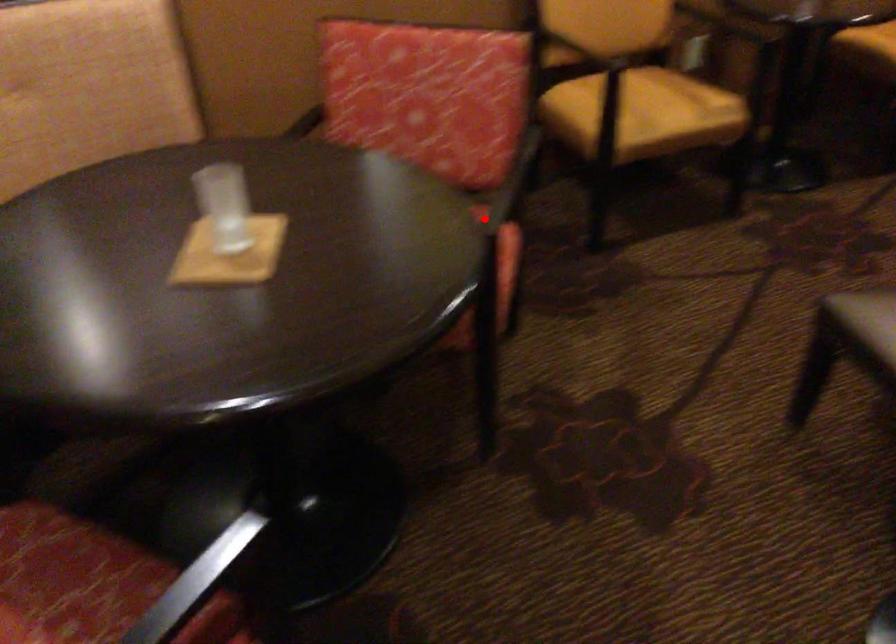
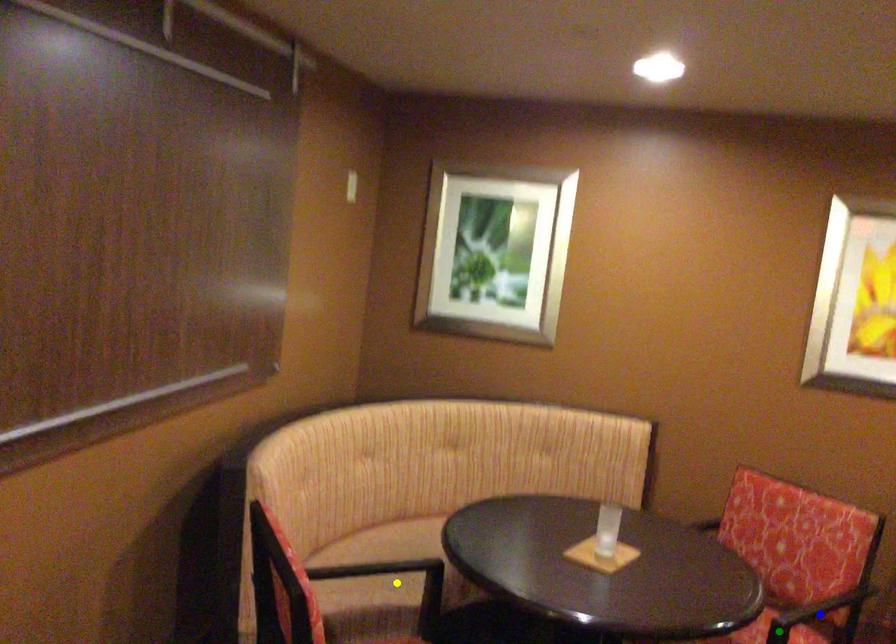
Question: I am providing you with two images of the same scene from different viewpoints. A red point is marked on the first image. You are given multiple points on the second image. Which mark in image 2 goes with the point in image 1?

Choices:
 (A) blue point
 (B) green point
 (C) yellow point

Answer: (B)